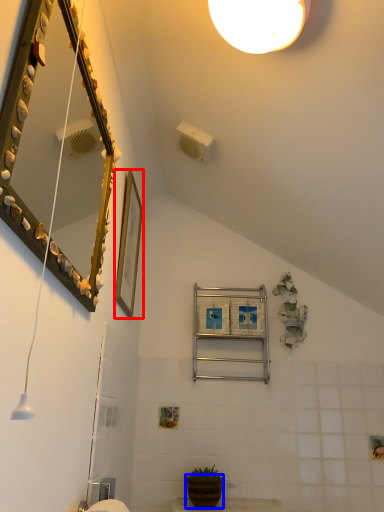
Question: Which of the following is the farthest to the observer, picture frame (highlighted by a red box) or flowerpot (highlighted by a blue box)?

Choices:
 (A) picture frame
 (B) flowerpot

Answer: (B)